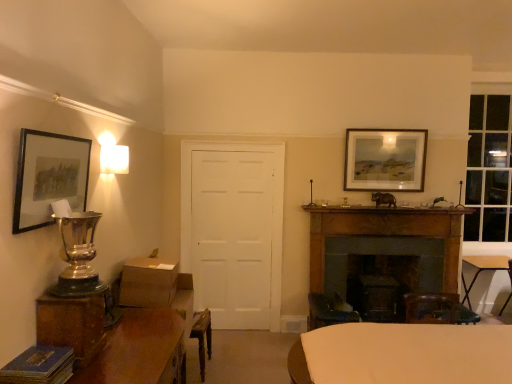
Image resolution: width=512 pixels, height=384 pixels. Identify the location of free space above dark brown wood fireplace at center right (from a real-world perspective). (378, 216).